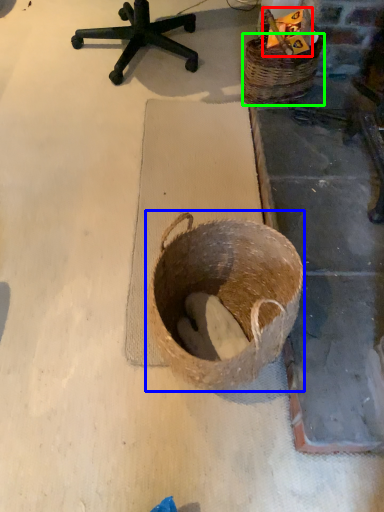
Question: Considering the real-world distances, which object is closest to scrap (highlighted by a red box)? basket (highlighted by a blue box) or basket (highlighted by a green box).

Choices:
 (A) basket
 (B) basket

Answer: (B)